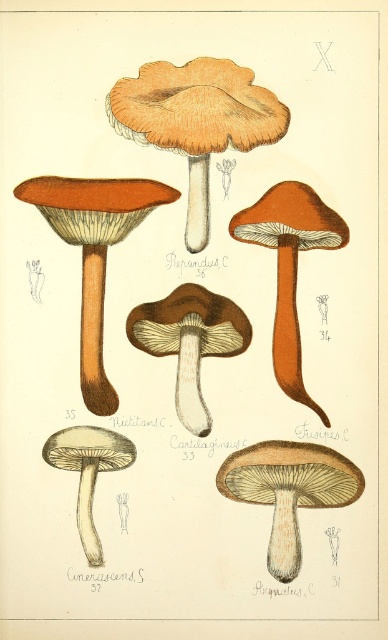
You are an artist sketching this botanical illustration and want to add shadows to the mushrooms. Since you know about perspective, which of the two mushrooms, the matte orange cap at upper center or the smooth beige mushroom at lower left, should you make the shadow longer to show depth?

The smooth beige mushroom at lower left should have a longer shadow because it is farther from the viewer compared to the matte orange cap at upper center, which is closer and would cast a shorter shadow.

You are observing the botanical illustration of mushrooms. There are two points marked in the image. The first point is at coordinates point (296, 492) and the second point is at coordinates point (190, 362). Which point is closer to you?

Point (296, 492) is closer to the camera than point (190, 362).

You are an artist trying to sketch this botanical illustration. You need to locate the smooth beige mushroom at center. Where should you look on the canvas?

The smooth beige mushroom at center is located at point (289, 490) on the canvas.